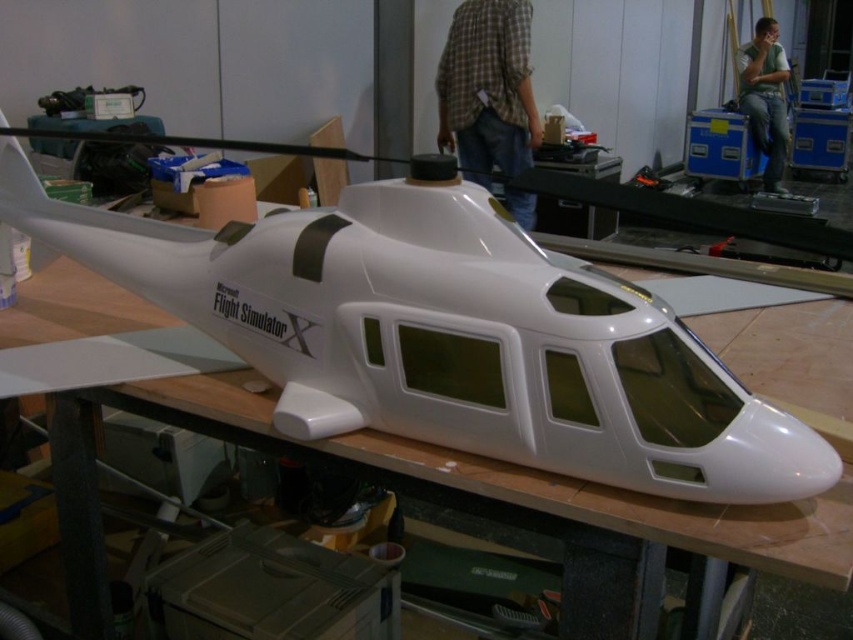
Question: Which point is closer to the camera?

Choices:
 (A) plaid fabric shirt at upper center
 (B) white glossy helicopter at center
 (C) green cotton shirt at upper right

Answer: (B)

Question: Among these objects, which one is nearest to the camera?

Choices:
 (A) white glossy helicopter at center
 (B) green cotton shirt at upper right

Answer: (A)

Question: Can you confirm if white glossy helicopter at center is positioned to the left of green cotton shirt at upper right?

Choices:
 (A) yes
 (B) no

Answer: (A)

Question: Is plaid fabric shirt at upper center positioned behind green cotton shirt at upper right?

Choices:
 (A) no
 (B) yes

Answer: (A)

Question: Which object is closer to the camera taking this photo?

Choices:
 (A) plaid fabric shirt at upper center
 (B) white glossy helicopter at center

Answer: (B)

Question: Is plaid fabric shirt at upper center positioned before green cotton shirt at upper right?

Choices:
 (A) no
 (B) yes

Answer: (B)